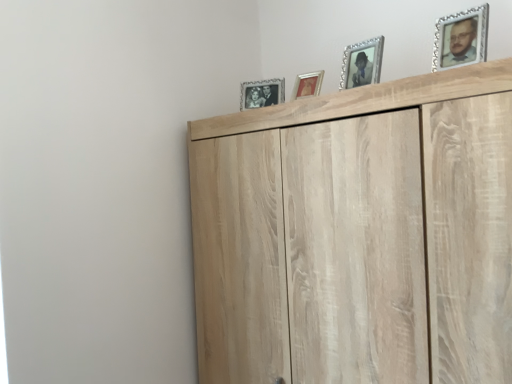
Question: In terms of width, does silver/glass photo frame at upper center, which is counted as the third picture frame, starting from the left, look wider or thinner when compared to light wood cupboard at upper center?

Choices:
 (A) thin
 (B) wide

Answer: (A)

Question: In terms of size, does silver/glass photo frame at upper center, which is counted as the third picture frame, starting from the left, appear bigger or smaller than light wood cupboard at upper center?

Choices:
 (A) small
 (B) big

Answer: (A)

Question: Which object is the closest to the gold-framed picture at upper center, which ranks as the 3th picture frame in front-to-back order?

Choices:
 (A) silver/glass photo frame at upper center, which is counted as the third picture frame, starting from the left
 (B) silver/glass photo frame at upper center, placed as the 1th picture frame when sorted from back to front
 (C) silver/glass picture frame at upper right, which is the 4th picture frame in left-to-right order
 (D) light wood cupboard at upper center

Answer: (B)

Question: Based on their relative distances, which object is farther from the gold-framed picture at upper center, which ranks as the 3th picture frame in front-to-back order?

Choices:
 (A) silver/glass photo frame at upper center, the second picture frame when ordered from front to back
 (B) silver/glass photo frame at upper center, which appears as the first picture frame when viewed from the left
 (C) silver/glass picture frame at upper right, marked as the 1th picture frame in a front-to-back arrangement
 (D) light wood cupboard at upper center

Answer: (D)